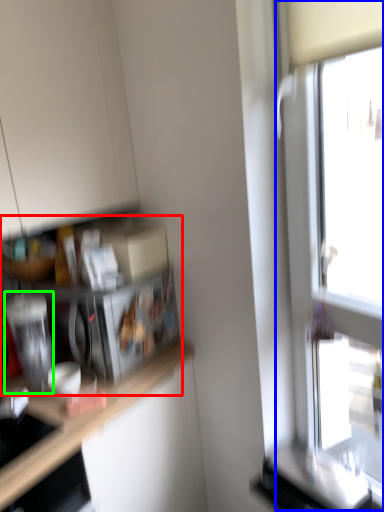
Question: Which object is positioned closest to shelf (highlighted by a red box)? Select from window (highlighted by a blue box) and appliance (highlighted by a green box).

Choices:
 (A) window
 (B) appliance

Answer: (B)